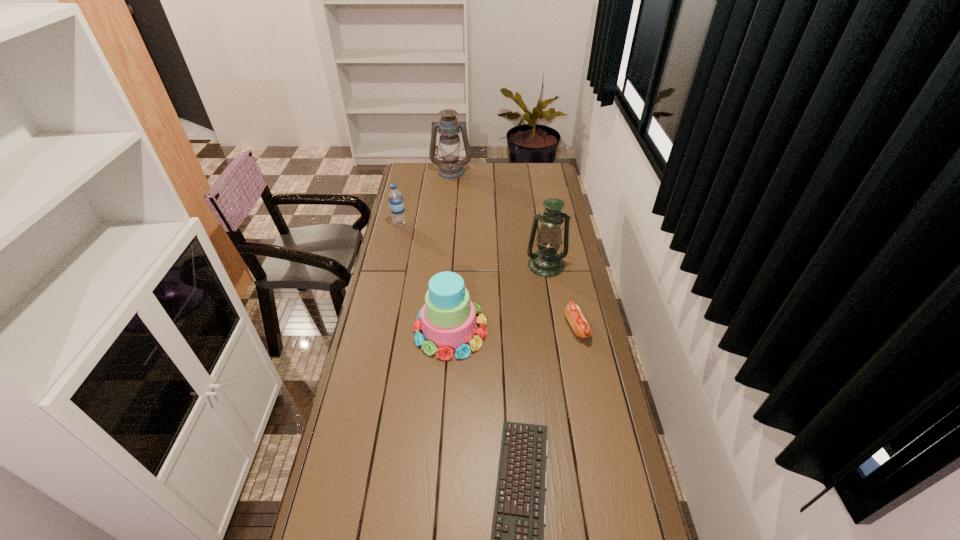
Image resolution: width=960 pixels, height=540 pixels. I want to click on the farther oil lamp, so click(450, 167).

At what (x,y) coordinates should I click in order to perform the action: click on the left oil lamp. Please return your answer as a coordinate pair (x, y). This screenshot has width=960, height=540. Looking at the image, I should click on (450, 167).

This screenshot has height=540, width=960. What are the coordinates of `the fourth nearest object` in the screenshot? It's located at (546, 262).

Find the location of a particular element. the nearer oil lamp is located at coordinates (546, 262).

The height and width of the screenshot is (540, 960). Find the location of `cake`. cake is located at coordinates (448, 323).

I want to click on water bottle, so click(395, 196).

Identify the location of the leftmost object. (395, 196).

At what (x,y) coordinates should I click in order to perform the action: click on the fifth tallest object. Please return your answer as a coordinate pair (x, y). Looking at the image, I should click on (581, 327).

Locate an element on the screen. Image resolution: width=960 pixels, height=540 pixels. vacant space situated on the front of the farthest object is located at coordinates (448, 200).

At what (x,y) coordinates should I click in order to perform the action: click on vacant region located on the back of the nearer oil lamp. Please return your answer as a coordinate pair (x, y). Image resolution: width=960 pixels, height=540 pixels. Looking at the image, I should click on (537, 209).